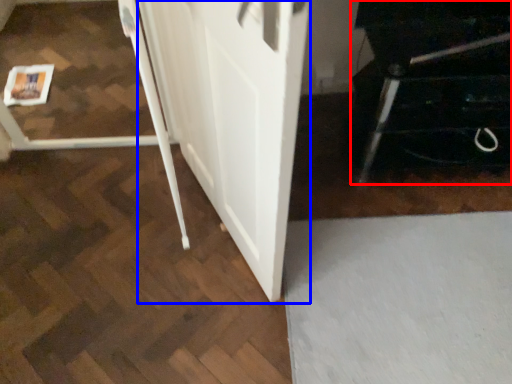
Question: Which object is further to the camera taking this photo, furniture (highlighted by a red box) or barn door (highlighted by a blue box)?

Choices:
 (A) furniture
 (B) barn door

Answer: (A)